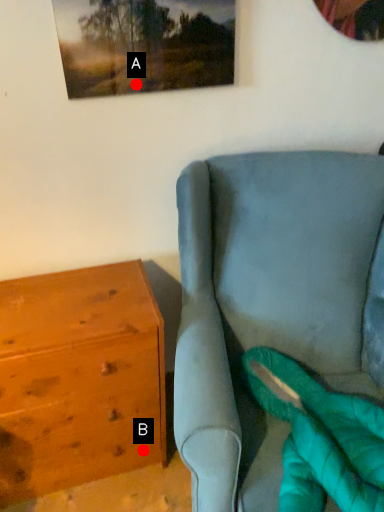
Question: Two points are circled on the image, labeled by A and B beside each circle. Which point appears closest to the camera in this image?

Choices:
 (A) A is closer
 (B) B is closer

Answer: (A)